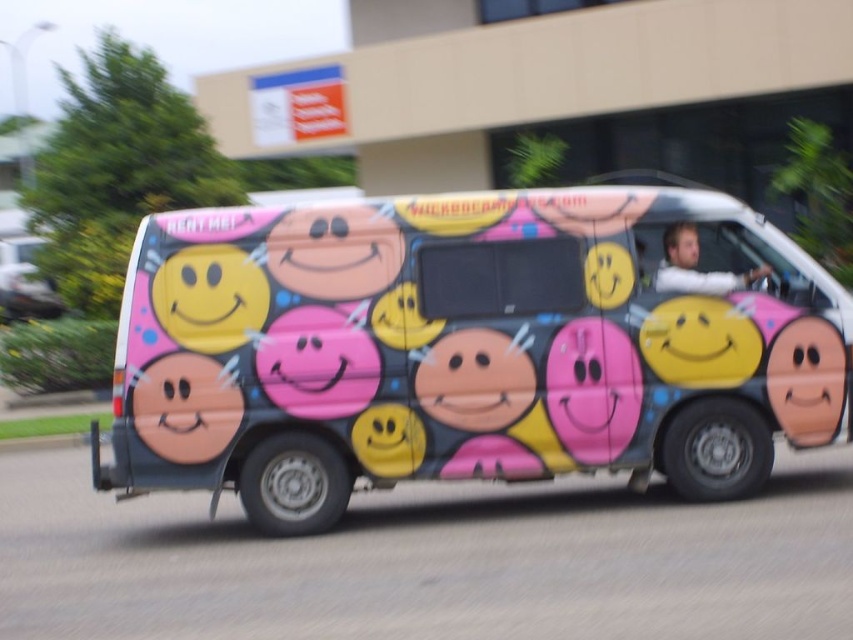
Question: Is matte pink smiley face at center behind matte skin face at center?

Choices:
 (A) yes
 (B) no

Answer: (B)

Question: Can you confirm if matte painted van at center is smaller than matte skin face at center?

Choices:
 (A) yes
 (B) no

Answer: (B)

Question: Which object is farther from the camera taking this photo?

Choices:
 (A) matte pink smiley face at center
 (B) matte painted van at center
 (C) matte skin face at center

Answer: (C)

Question: Which point is farther to the camera?

Choices:
 (A) (196, 456)
 (B) (526, 250)

Answer: (B)

Question: Which point is farther to the camera?

Choices:
 (A) matte skin face at center
 (B) matte painted van at center

Answer: (A)

Question: Can you confirm if matte painted van at center is positioned to the left of matte pink smiley face at center?

Choices:
 (A) yes
 (B) no

Answer: (B)